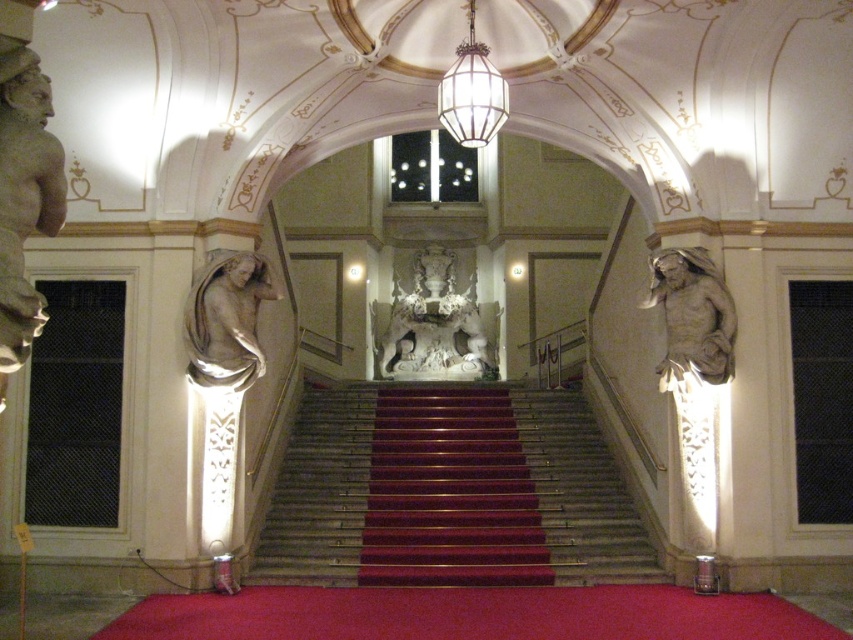
You are an interior designer planning to place a new decorative item between the matte gray statue at right and the clear glass lantern at center. Considering their sizes, which object should you avoid placing something wider than the other to maintain balance?

You should avoid placing something wider than the clear glass lantern at center because the matte gray statue at right is thinner than it, so the lantern is wider. To maintain balance, wider items should be placed near the thinner statue.

You are standing in the grand hall and want to reach the point marked at coordinates point (693, 340). Given that you can walk 3 feet per second, how many seconds will it take you to reach that point?

The distance between you and point (693, 340) is 118.59 feet. At a walking speed of 3 feet per second, it will take approximately 39.53 seconds to reach the point.

You are standing in the grand hall and want to move from the point closer to you to the point further away. Which path should you take? The points are labeled as point (251, 284) and point (462, 64). Please specify the correct order of the points in your path.

You should move from point (251, 284) to point (462, 64) because point (251, 284) is closer to you and point (462, 64) is further away according to their positions.